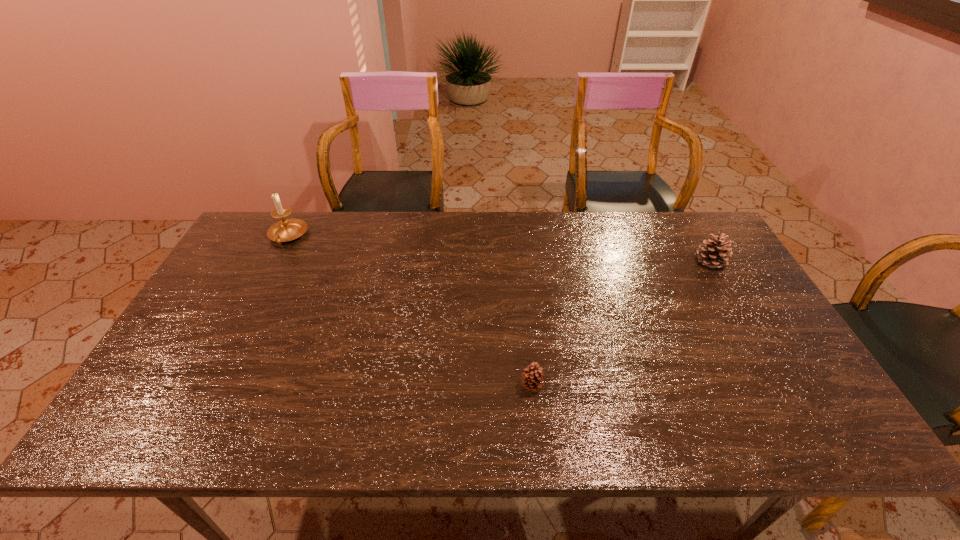
This screenshot has height=540, width=960. In order to click on object that stands as the closest to the candle holder in this screenshot , I will do `click(531, 378)`.

Locate which object is the second closest to the right pinecone. Please provide its 2D coordinates. Your answer should be formatted as a tuple, i.e. [(x, y)], where the tuple contains the x and y coordinates of a point satisfying the conditions above.

[(285, 230)]

At what (x,y) coordinates should I click in order to perform the action: click on free point that satisfies the following two spatial constraints: 1. with a handle on the side of the left pinecone; 2. on the left side of the leftmost object. Please return your answer as a coordinate pair (x, y). This screenshot has width=960, height=540. Looking at the image, I should click on (210, 386).

I want to click on free region that satisfies the following two spatial constraints: 1. with a handle on the side of the tallest object; 2. on the left side of the farther pinecone, so click(275, 262).

Where is `vacant area that satisfies the following two spatial constraints: 1. with a handle on the side of the nearest object; 2. on the left side of the tallest object`? vacant area that satisfies the following two spatial constraints: 1. with a handle on the side of the nearest object; 2. on the left side of the tallest object is located at coordinates (210, 386).

Identify the location of vacant space that satisfies the following two spatial constraints: 1. with a handle on the side of the farthest object; 2. on the right side of the second shortest object. This screenshot has width=960, height=540. (275, 262).

At what (x,y) coordinates should I click in order to perform the action: click on free location that satisfies the following two spatial constraints: 1. with a handle on the side of the left pinecone; 2. on the right side of the farthest object. Please return your answer as a coordinate pair (x, y). Looking at the image, I should click on (210, 386).

Where is `vacant point that satisfies the following two spatial constraints: 1. with a handle on the side of the right pinecone; 2. on the left side of the farthest object`? vacant point that satisfies the following two spatial constraints: 1. with a handle on the side of the right pinecone; 2. on the left side of the farthest object is located at coordinates (275, 262).

In order to click on free location that satisfies the following two spatial constraints: 1. on the back side of the shortest object; 2. on the left side of the second shortest object in this screenshot , I will do `click(519, 262)`.